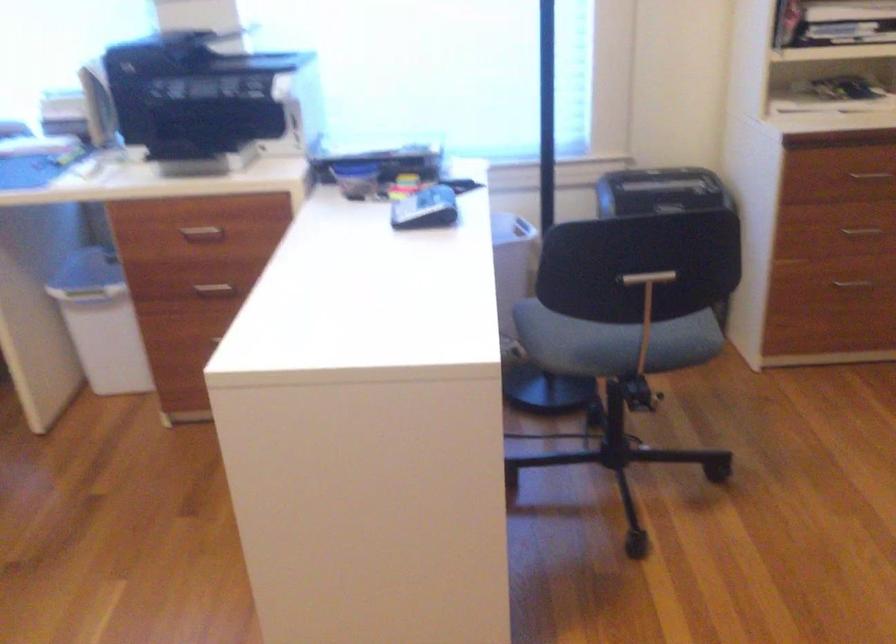
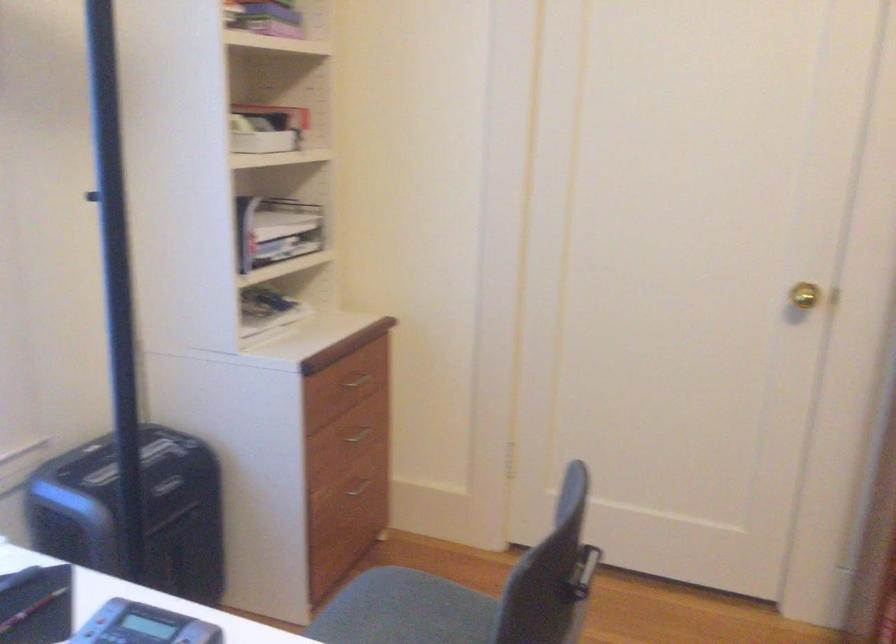
The point at (x=681, y=322) is marked in the first image. Where is the corresponding point in the second image?

(405, 611)